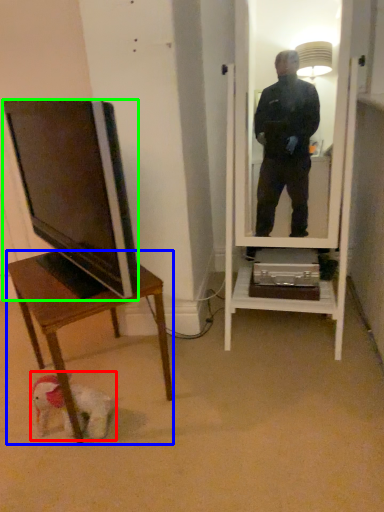
Question: Based on their relative distances, which object is nearer to dog (highlighted by a red box)? Choose from desk (highlighted by a blue box) and television (highlighted by a green box).

Choices:
 (A) desk
 (B) television

Answer: (A)